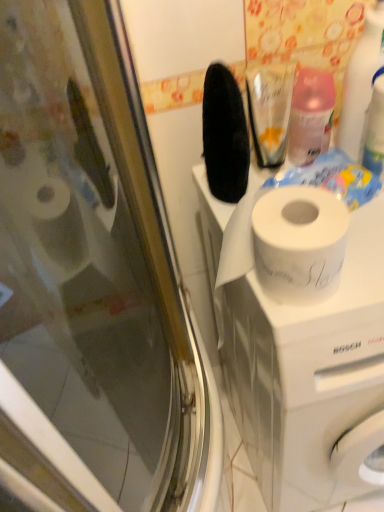
Question: Considering the relative sizes of white glossy spray bottle at upper right, positioned as the 1th cleaning product in right-to-left order, and white matte washing machine at upper center in the image provided, is white glossy spray bottle at upper right, positioned as the 1th cleaning product in right-to-left order, wider than white matte washing machine at upper center?

Choices:
 (A) no
 (B) yes

Answer: (A)

Question: Is white glossy spray bottle at upper right, positioned as the 1th cleaning product in right-to-left order, shorter than white matte washing machine at upper center?

Choices:
 (A) yes
 (B) no

Answer: (A)

Question: Can you confirm if white glossy spray bottle at upper right, the second cleaning product positioned from the left, is smaller than white matte washing machine at upper center?

Choices:
 (A) no
 (B) yes

Answer: (B)

Question: Considering the relative positions of white glossy spray bottle at upper right, the second cleaning product positioned from the left, and white matte washing machine at upper center in the image provided, is white glossy spray bottle at upper right, the second cleaning product positioned from the left, to the left of white matte washing machine at upper center from the viewer's perspective?

Choices:
 (A) no
 (B) yes

Answer: (B)

Question: Is white glossy spray bottle at upper right, positioned as the 1th cleaning product in right-to-left order, positioned with its back to white matte washing machine at upper center?

Choices:
 (A) yes
 (B) no

Answer: (B)

Question: Is white glossy spray bottle at upper right, the second cleaning product positioned from the left, positioned far away from white matte washing machine at upper center?

Choices:
 (A) yes
 (B) no

Answer: (B)

Question: Considering the relative positions of white matte washing machine at upper center and white glossy spray bottle at upper right, positioned as the 1th cleaning product in right-to-left order, in the image provided, is white matte washing machine at upper center behind white glossy spray bottle at upper right, positioned as the 1th cleaning product in right-to-left order,?

Choices:
 (A) yes
 (B) no

Answer: (B)

Question: From a real-world perspective, is white matte washing machine at upper center located beneath white glossy spray bottle at upper right, the second cleaning product positioned from the left?

Choices:
 (A) no
 (B) yes

Answer: (B)

Question: Considering the relative sizes of white matte washing machine at upper center and white glossy spray bottle at upper right, the second cleaning product positioned from the left, in the image provided, is white matte washing machine at upper center shorter than white glossy spray bottle at upper right, the second cleaning product positioned from the left,?

Choices:
 (A) no
 (B) yes

Answer: (A)

Question: Is white matte washing machine at upper center completely or partially outside of white glossy spray bottle at upper right, positioned as the 1th cleaning product in right-to-left order?

Choices:
 (A) no
 (B) yes

Answer: (B)

Question: Can you confirm if white matte washing machine at upper center is thinner than white glossy spray bottle at upper right, positioned as the 1th cleaning product in right-to-left order?

Choices:
 (A) no
 (B) yes

Answer: (A)

Question: Are white matte washing machine at upper center and white glossy spray bottle at upper right, the second cleaning product positioned from the left, far apart?

Choices:
 (A) yes
 (B) no

Answer: (B)

Question: Can we say white matte washing machine at upper center lies outside translucent plastic spray bottle at upper right, acting as the 1th cleaning product starting from the left?

Choices:
 (A) yes
 (B) no

Answer: (A)